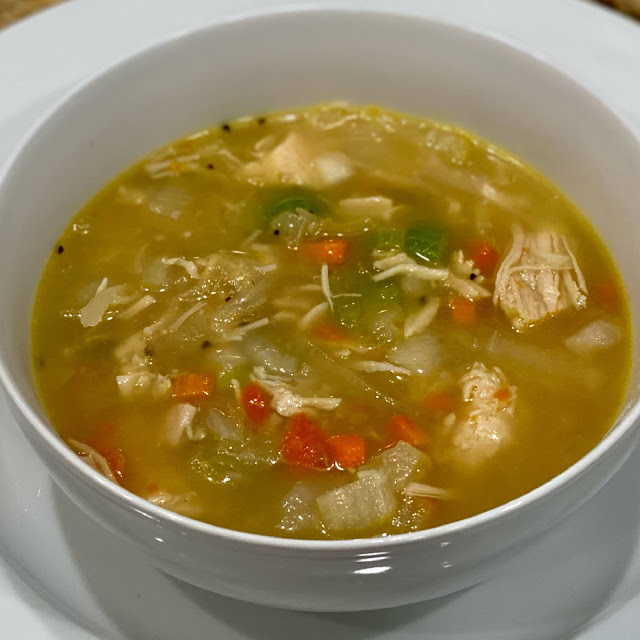
At what (x,y) coordinates should I click in order to perform the action: click on plate. Please return your answer as a coordinate pair (x, y). Looking at the image, I should click on (68, 559).